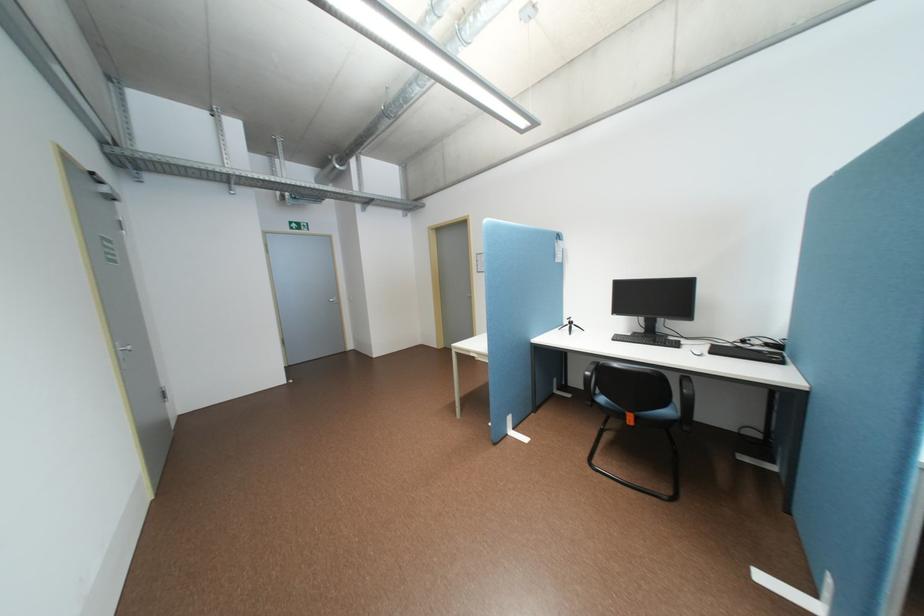
Which object does [695,351] point to?

This point indicates the black computer mouse.